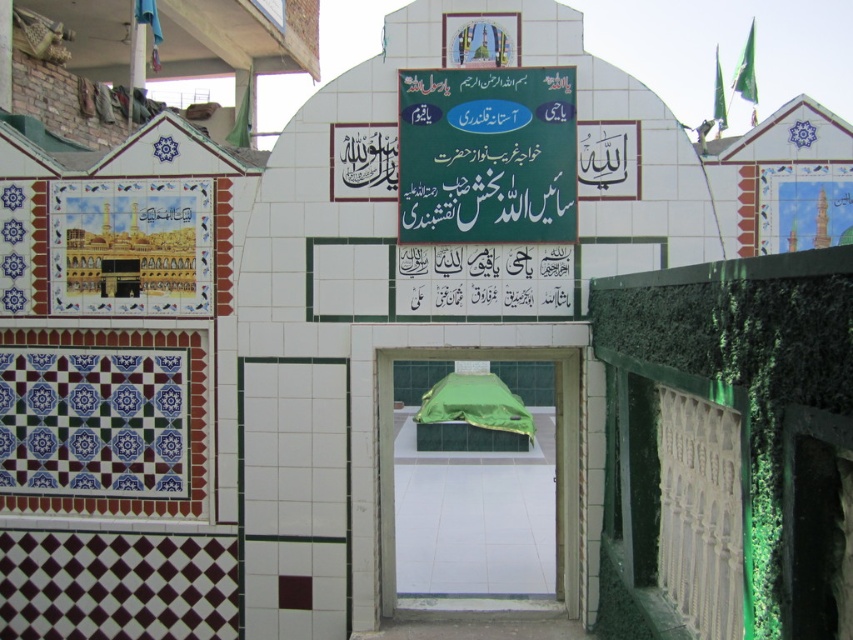
Who is more forward, (489, 109) or (392, 557)?

Positioned in front is point (489, 109).

Which of these two, green fabric sign at center or green fabric-covered structure at center, stands shorter?

green fabric sign at center is shorter.

Is point (509, 125) positioned in front of point (383, 518)?

Yes.

Where is `green fabric sign at center`? Image resolution: width=853 pixels, height=640 pixels. green fabric sign at center is located at coordinates (486, 156).